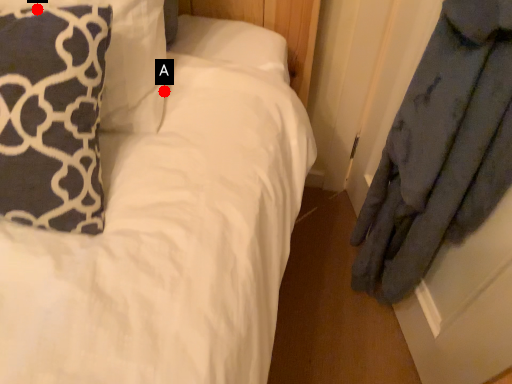
Question: Two points are circled on the image, labeled by A and B beside each circle. Among these points, which one is farthest from the camera?

Choices:
 (A) A is further
 (B) B is further

Answer: (A)